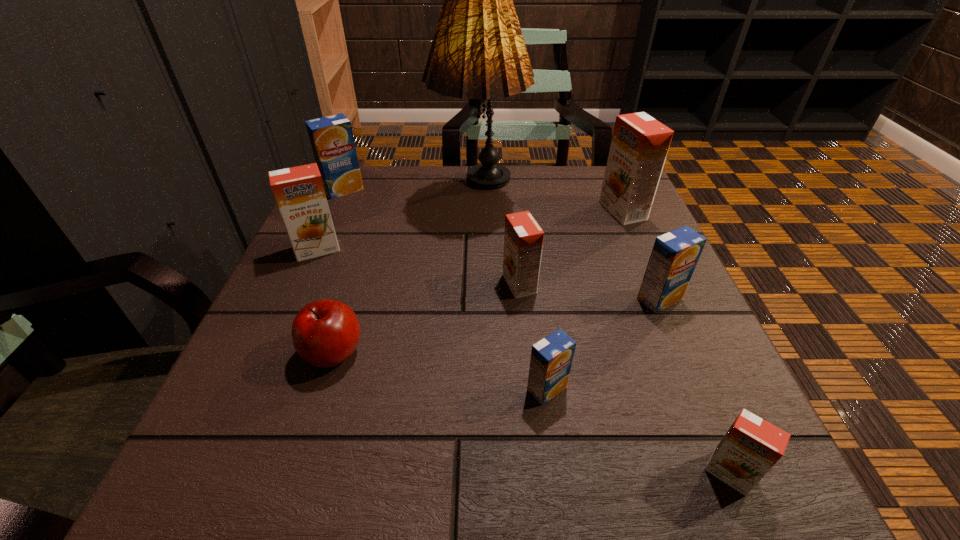
Locate an element on the screen. lampshade is located at coordinates (478, 52).

Where is `the tallest orange juice`? This screenshot has height=540, width=960. the tallest orange juice is located at coordinates click(639, 146).

Where is `the farthest orange orange juice`? The image size is (960, 540). the farthest orange orange juice is located at coordinates (639, 146).

I want to click on the leftmost blue orange_juice, so click(x=331, y=137).

I want to click on the farthest blue orange_juice, so click(x=331, y=137).

Where is `the leftmost orange orange juice`? The height and width of the screenshot is (540, 960). the leftmost orange orange juice is located at coordinates (299, 192).

This screenshot has width=960, height=540. What are the coordinates of `the sixth nearest object` in the screenshot? It's located at (299, 192).

At what (x,y) coordinates should I click in order to perform the action: click on the second nearest orange orange juice. Please return your answer as a coordinate pair (x, y). This screenshot has width=960, height=540. Looking at the image, I should click on (523, 238).

Where is `the third orange orange juice from right to left`? the third orange orange juice from right to left is located at coordinates (523, 238).

Find the location of a particular element. The image size is (960, 540). the second biggest blue orange_juice is located at coordinates (674, 256).